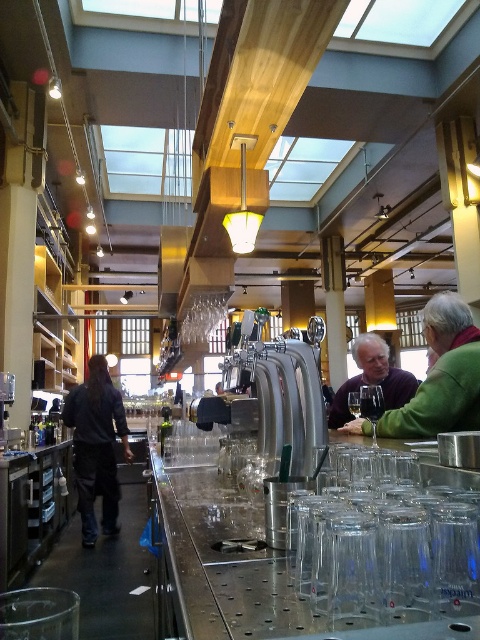
Between matte purple sweater at center and clear glass wine glass at bar, which one appears on the left side from the viewer's perspective?

clear glass wine glass at bar is more to the left.

Does matte purple sweater at center have a smaller size compared to clear glass wine glass at bar?

No, matte purple sweater at center is not smaller than clear glass wine glass at bar.

Is point (331, 413) positioned behind point (348, 401)?

That is True.

Find the location of a particular element. matte purple sweater at center is located at coordinates click(372, 378).

Consider the image. Which of these two, green fabric jacket at right or clear glass wine glass at bar, stands shorter?

clear glass wine glass at bar is shorter.

Is green fabric jacket at right wider than clear glass wine glass at bar?

Yes.

Identify the location of green fabric jacket at right. (443, 376).

Is dark gray jacket at left below clear glass wine glass at bar?

Indeed, dark gray jacket at left is positioned under clear glass wine glass at bar.

Between dark gray jacket at left and clear glass wine glass at bar, which one is positioned lower?

Positioned lower is dark gray jacket at left.

What do you see at coordinates (96, 445) in the screenshot? Image resolution: width=480 pixels, height=640 pixels. I see `dark gray jacket at left` at bounding box center [96, 445].

At what (x,y) coordinates should I click in order to perform the action: click on dark gray jacket at left. Please return your answer as a coordinate pair (x, y). The height and width of the screenshot is (640, 480). Looking at the image, I should click on (96, 445).